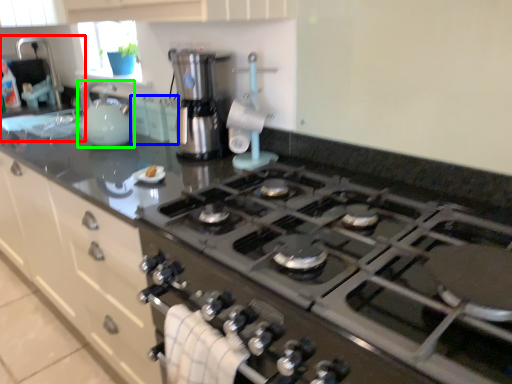
Question: Estimate the real-world distances between objects in this image. Which object is closer to sink (highlighted by a red box), cabinetry (highlighted by a blue box) or kitchen appliance (highlighted by a green box)?

Choices:
 (A) cabinetry
 (B) kitchen appliance

Answer: (B)